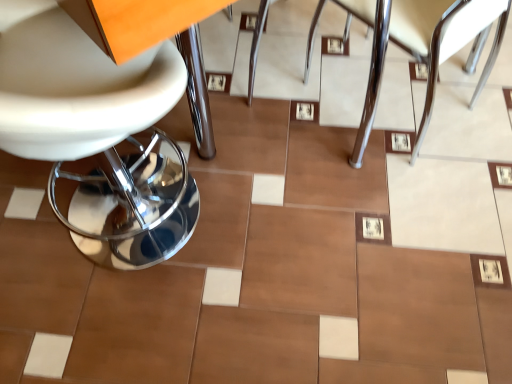
Question: Is point (439, 13) positioned closer to the camera than point (151, 137)?

Choices:
 (A) farther
 (B) closer

Answer: (B)

Question: In the image, is satin chrome chair at center, which is the second chair in left-to-right order, positioned in front of or behind white leather chair at left, the 1th chair from the left?

Choices:
 (A) front
 (B) behind

Answer: (B)

Question: Is satin chrome chair at center, which is the second chair in left-to-right order, wider or thinner than white leather chair at left, the 1th chair from the left?

Choices:
 (A) thin
 (B) wide

Answer: (B)

Question: In terms of size, does white leather chair at left, the 1th chair from the left, appear bigger or smaller than satin chrome chair at center, marked as the first chair in a right-to-left arrangement?

Choices:
 (A) big
 (B) small

Answer: (A)

Question: Does point (0, 115) appear closer or farther from the camera than point (370, 86)?

Choices:
 (A) farther
 (B) closer

Answer: (B)

Question: Looking at their shapes, would you say white leather chair at left, marked as the second chair in a right-to-left arrangement, is wider or thinner than satin chrome chair at center, marked as the first chair in a right-to-left arrangement?

Choices:
 (A) wide
 (B) thin

Answer: (B)

Question: From a real-world perspective, is white leather chair at left, marked as the second chair in a right-to-left arrangement, positioned above or below satin chrome chair at center, which is the second chair in left-to-right order?

Choices:
 (A) below
 (B) above

Answer: (B)